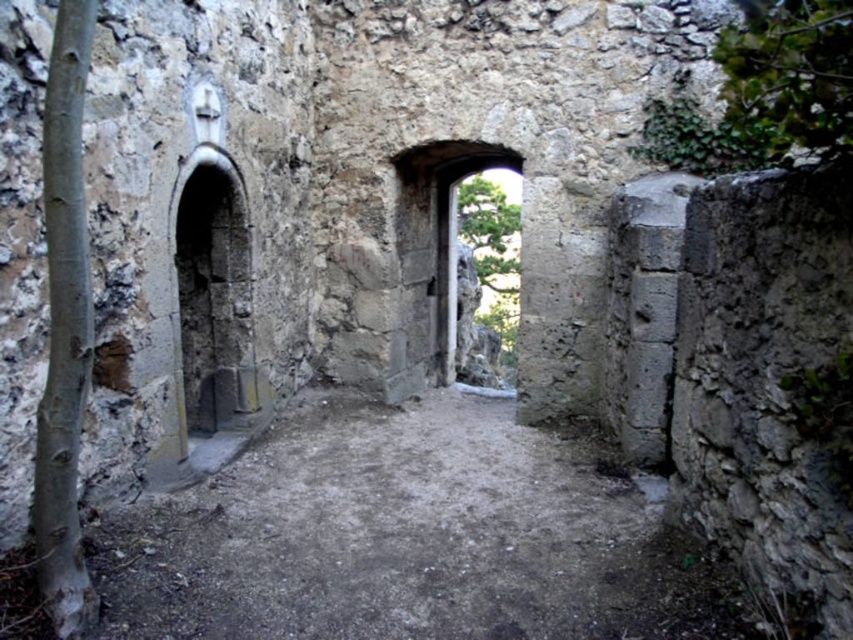
Based on the photo, is rusty stone arch at left to the left of stone archway at center from the viewer's perspective?

Correct, you'll find rusty stone arch at left to the left of stone archway at center.

Is rusty stone arch at left taller than stone archway at center?

In fact, rusty stone arch at left may be shorter than stone archway at center.

What do you see at coordinates (213, 308) in the screenshot? I see `rusty stone arch at left` at bounding box center [213, 308].

Identify the location of rusty stone arch at left. (213, 308).